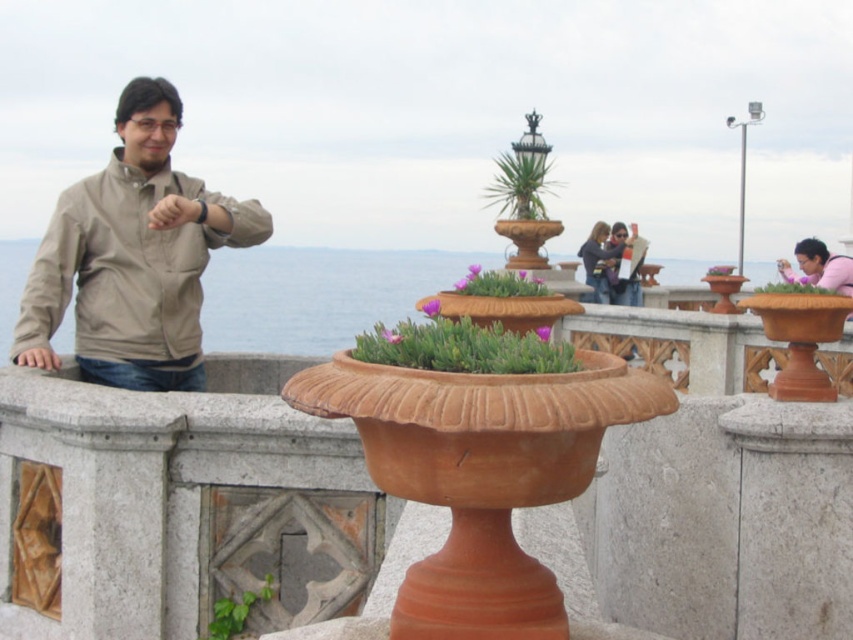
You are standing on the balcony and want to move from the terracotta textured planter at center to the green leafy plant at center. Which direction should you move to reach it?

The terracotta textured planter at center is to the left of green leafy plant at center, so you should move to the right to reach it.

You are standing on the balcony and want to move from the green leafy plant at lower left to the green leafy plant at center. Which direction should you move to reach it?

You should move to the right to reach the green leafy plant at center from the green leafy plant at lower left, since the latter is positioned on the left side of the former.

You are standing on the balcony and want to place a small statue exactly at the center of the green leafy plant at upper center. What coordinates should you aim for?

The coordinates for the green leafy plant at upper center are point [520,182], so you should aim for those coordinates to place the statue exactly at its center.